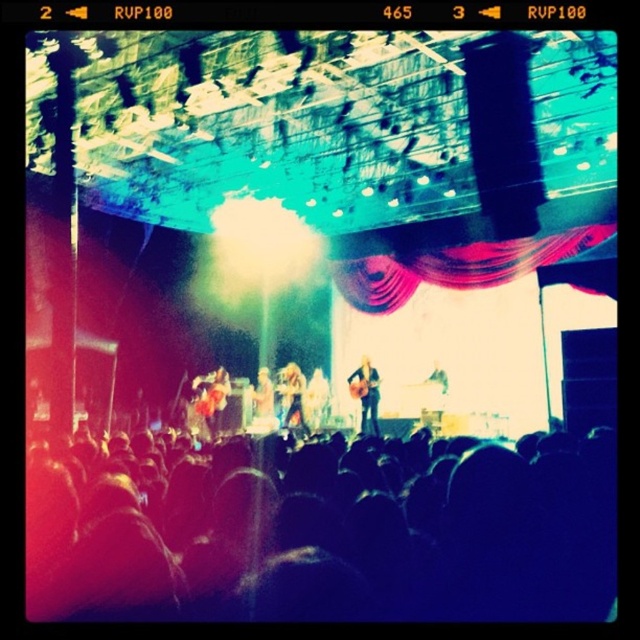
You are a photographer at the concert and want to focus your camera on the shiny silver guitar at center. The camera is currently pointing at point with coordinates point (291, 394). Is the camera pointing at the correct location?

Yes, the camera is pointing at the correct location because point (291, 394) is on shiny silver guitar at center.

You are a photographer at the concert and want to capture a shot of the shiny silver guitar at center without the black matte crowd at lower center blocking it. Based on their positions, is this possible?

The black matte crowd at lower center is above the shiny silver guitar at center, so the crowd is positioned higher up in the image. Since the crowd is above the guitar, you can aim your camera downward to capture the guitar without the crowd blocking it.

You are a photographer at the concert and want to capture a closeup of the shiny red guitar at center and the shiny silver guitar at center. Which guitar should you focus on first if you want to start with the one on the left?

The shiny red guitar at center is to the left of the shiny silver guitar at center, so you should focus on the shiny red guitar at center first.